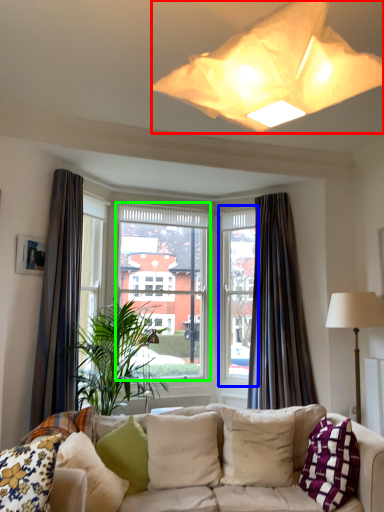
Question: Which is farther away from lamp (highlighted by a red box)? window frame (highlighted by a blue box) or window screen (highlighted by a green box)?

Choices:
 (A) window frame
 (B) window screen

Answer: (A)